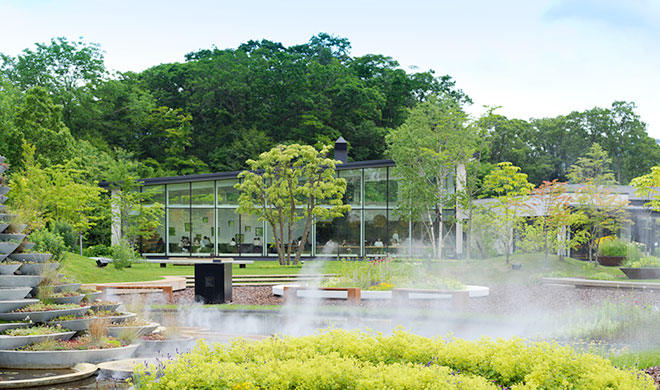
Find the location of `flower decor on left side of photo`. flower decor on left side of photo is located at coordinates (x=80, y=336), (x=55, y=283).